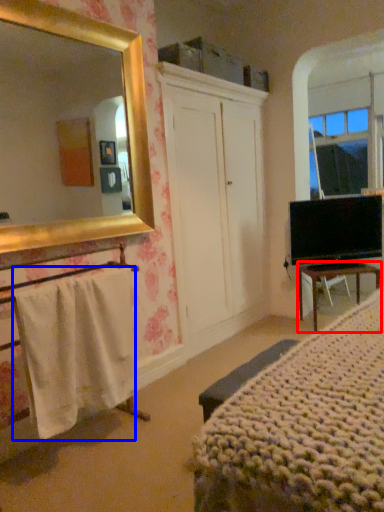
Question: Which object appears farthest to the camera in this image, desk (highlighted by a red box) or towel/napkin (highlighted by a blue box)?

Choices:
 (A) desk
 (B) towel/napkin

Answer: (A)